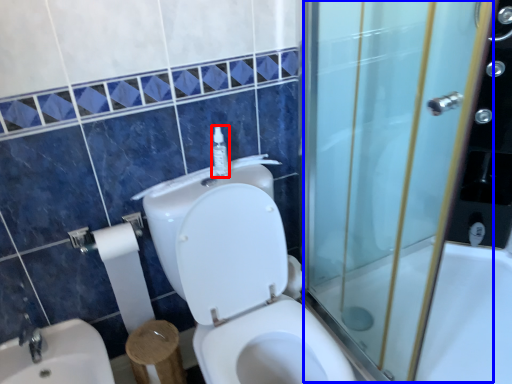
Question: Which object appears closest to the camera in this image, soap dispenser (highlighted by a red box) or screen door (highlighted by a blue box)?

Choices:
 (A) soap dispenser
 (B) screen door

Answer: (B)